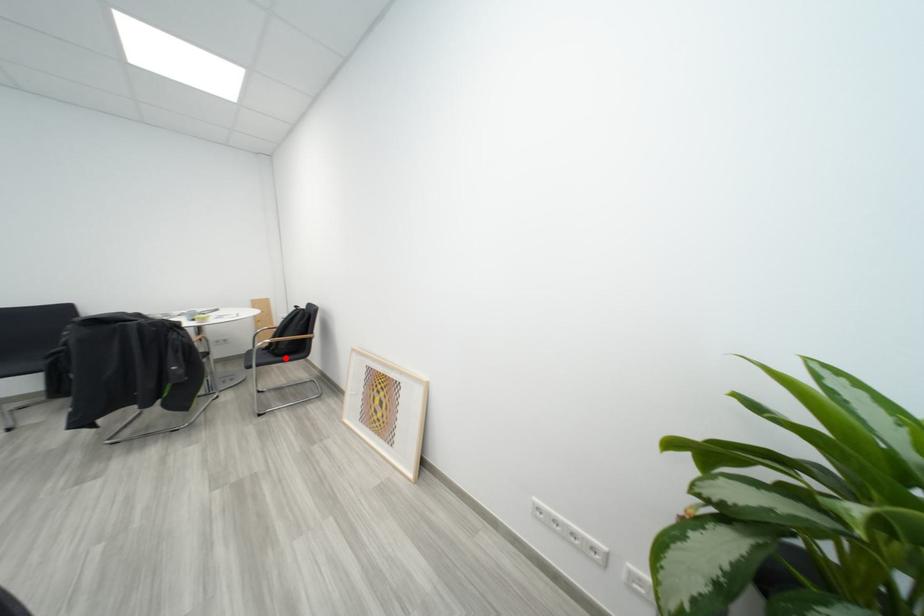
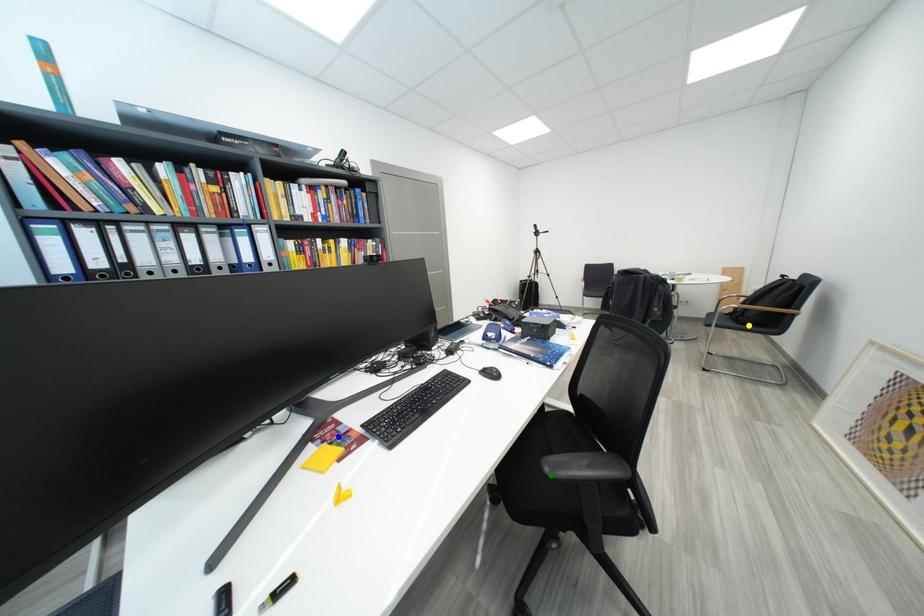
Question: I am providing you with two images of the same scene from different viewpoints. A red point is marked on the first image. You are given multiple points on the second image. Which mark in image 2 goes with the point in image 1?

Choices:
 (A) yellow point
 (B) green point
 (C) blue point

Answer: (A)